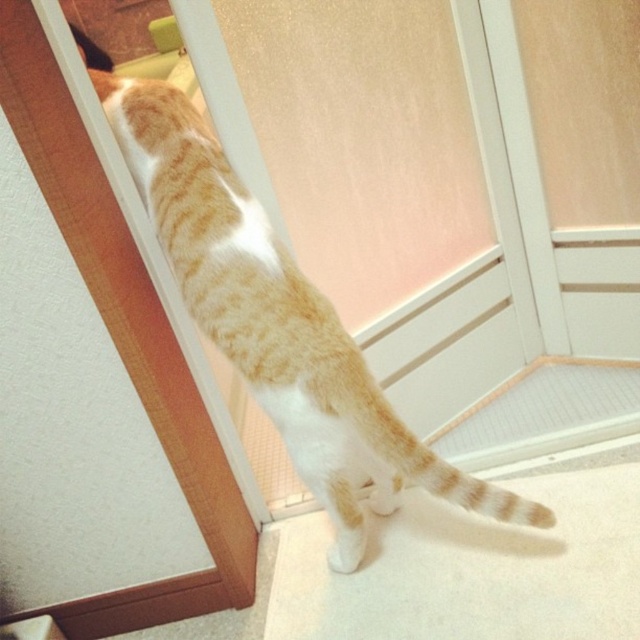
You are a delivery person holding a large package that measures 35 centimeters in length. You need to pass through the space between the orange tabby cat at center and the matte wood screen door at upper left. Can you fit through the space without squeezing?

The distance between the orange tabty cat at center and the matte wood screen door at upper left is 30.99 centimeters. Since the package is 35 centimeters long, it is longer than the available space. Therefore, you cannot fit through the space without squeezing.

Based on the photo, you are trying to decide if the orange tabby cat at center can fit through the matte wood screen door at upper left. Based on their widths, can the cat pass through the door?

The orange tabby cat at center is wider than the matte wood screen door at upper left, so the cat cannot pass through the door.